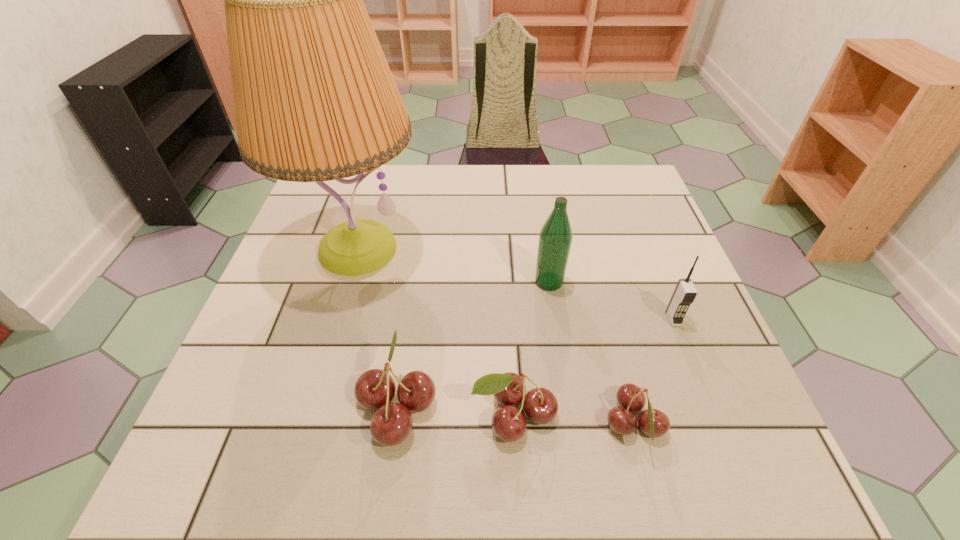
Where is `the leftmost cherry`? The image size is (960, 540). the leftmost cherry is located at coordinates (392, 422).

The width and height of the screenshot is (960, 540). I want to click on the fifth tallest object, so click(540, 405).

Identify the location of the second cherry from right to left. This screenshot has height=540, width=960. (540, 405).

The image size is (960, 540). Identify the location of the shortest object. (654, 423).

You are a GUI agent. You are given a task and a screenshot of the screen. Output one action in this format:
    pyautogui.click(x=<x>, y=<y>)
    Task: Click on the fifth object from left to right
    This screenshot has height=540, width=960.
    Given the screenshot: What is the action you would take?
    pyautogui.click(x=654, y=423)

The height and width of the screenshot is (540, 960). I want to click on the second tallest object, so click(x=555, y=238).

In order to click on the tallest object in this screenshot , I will do `click(314, 98)`.

Locate an element on the screen. The image size is (960, 540). the third farthest object is located at coordinates (685, 292).

Find the location of a particular element. The height and width of the screenshot is (540, 960). cellular telephone is located at coordinates (685, 292).

You are a GUI agent. You are given a task and a screenshot of the screen. Output one action in this format:
    pyautogui.click(x=<x>, y=<y>)
    Task: Click on the free space located on the leaves of the leftmost cherry
    
    Given the screenshot: What is the action you would take?
    pyautogui.click(x=284, y=406)